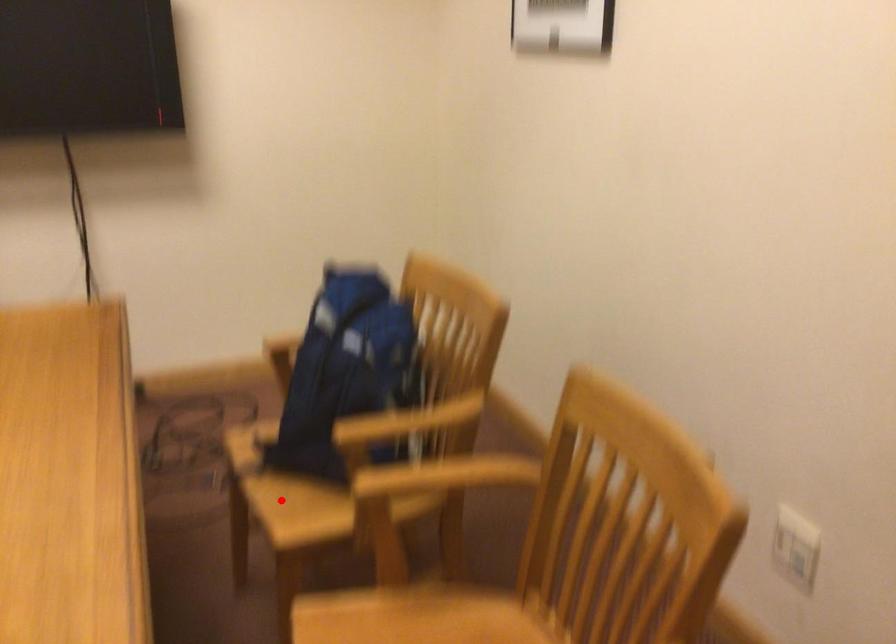
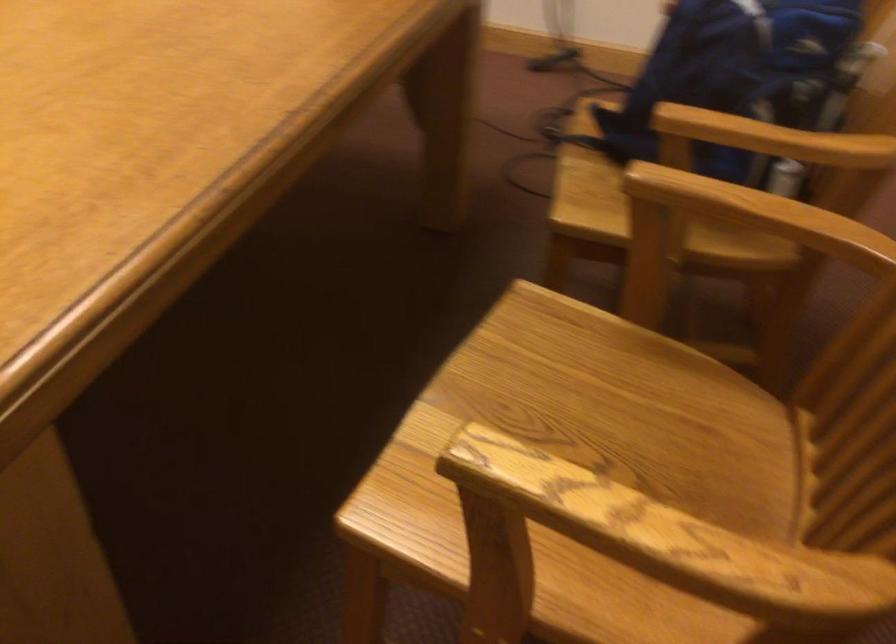
Question: A red point is marked in image1. In image2, is the corresponding 3D point closer to the camera or farther? Reply with the corresponding letter.

Choices:
 (A) The corresponding 3D point is closer.
 (B) The corresponding 3D point is farther.

Answer: (A)